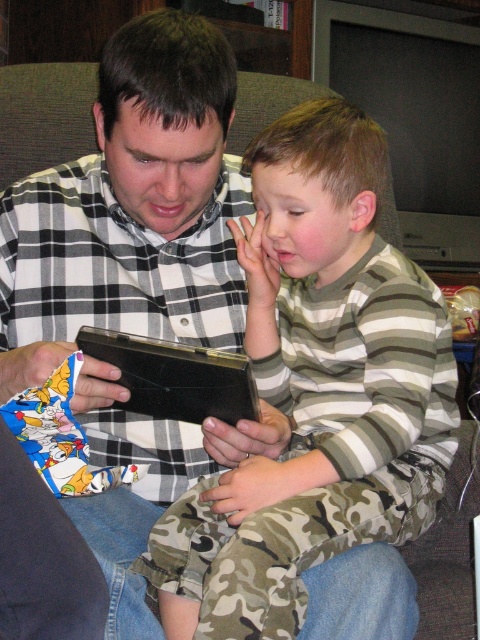
Question: Which object appears closest to the camera in this image?

Choices:
 (A) plaid shirt at center
 (B) striped cotton shirt at center

Answer: (B)

Question: Which point is farther to the camera?

Choices:
 (A) (227, 214)
 (B) (196, 394)
 (C) (289, 372)

Answer: (A)

Question: Is plaid shirt at center thinner than black leather tablet at center?

Choices:
 (A) yes
 (B) no

Answer: (B)

Question: Does plaid shirt at center have a larger size compared to black leather tablet at center?

Choices:
 (A) no
 (B) yes

Answer: (B)

Question: Is striped cotton shirt at center thinner than plaid shirt at center?

Choices:
 (A) no
 (B) yes

Answer: (A)

Question: Which of the following is the farthest from the observer?

Choices:
 (A) (139, 92)
 (B) (314, 125)

Answer: (B)